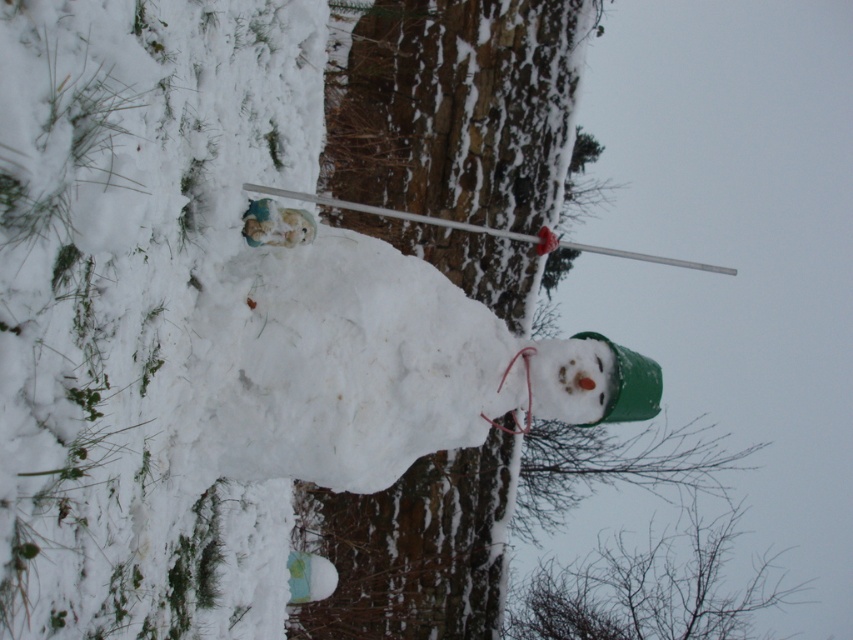
Question: Among these points, which one is nearest to the camera?

Choices:
 (A) (692, 260)
 (B) (494, 486)
 (C) (750, 596)

Answer: (B)

Question: Which point appears farthest from the camera in this image?

Choices:
 (A) (296, 192)
 (B) (537, 125)

Answer: (B)

Question: Can you confirm if silvery branches at lower right is bigger than white plastic ski pole at upper center?

Choices:
 (A) yes
 (B) no

Answer: (B)

Question: Estimate the real-world distances between objects in this image. Which object is closer to the white plastic ski pole at upper center?

Choices:
 (A) green matte snowman at center
 (B) silvery branches at lower right

Answer: (A)

Question: Considering the relative positions of silvery branches at lower right and white plastic ski pole at upper center in the image provided, where is silvery branches at lower right located with respect to white plastic ski pole at upper center?

Choices:
 (A) right
 (B) left

Answer: (A)

Question: Does green matte snowman at center lie behind white plastic ski pole at upper center?

Choices:
 (A) no
 (B) yes

Answer: (B)